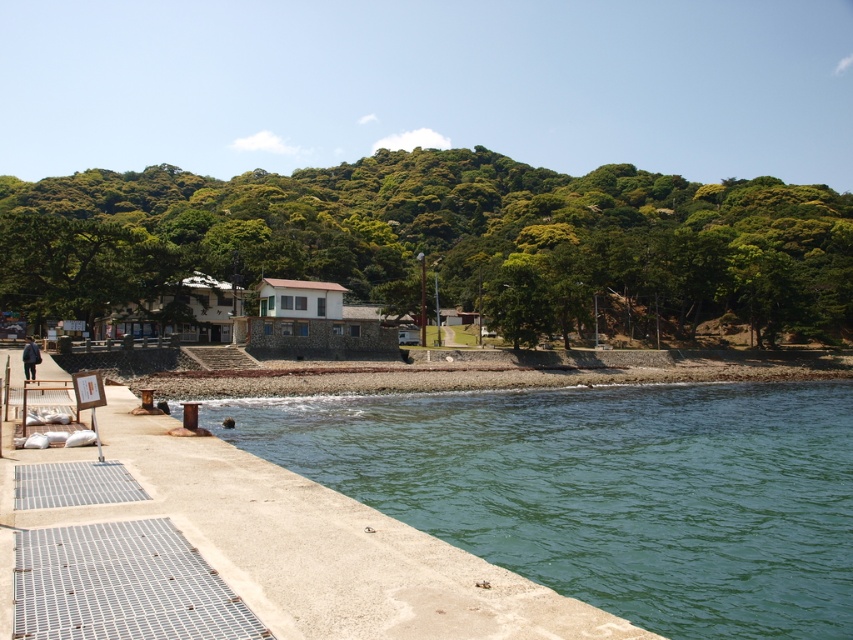
Can you confirm if green leafy hillside at center is thinner than green concrete water at lower left?

No, green leafy hillside at center is not thinner than green concrete water at lower left.

Is green leafy hillside at center wider than green concrete water at lower left?

Yes, green leafy hillside at center is wider than green concrete water at lower left.

The image size is (853, 640). What are the coordinates of `green leafy hillside at center` in the screenshot? It's located at (440, 237).